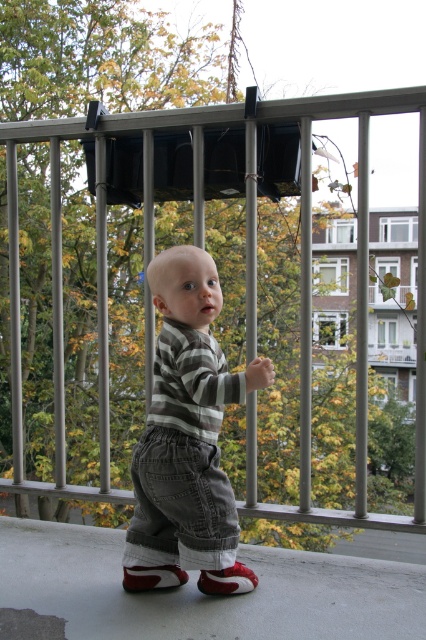
The child is trying to climb over the balcony railing. You are a safety inspector checking if the child can fit through the space between the metallic vertical bars. The child is wearing the red suede sneaker at center and the white leather sneaker at center. Which sneaker is closer to the ground?

The red suede sneaker at center is located below the white leather sneaker at center, so the red suede sneaker at center is closer to the ground.

You are a parent who wants to ensure the child is safe on the balcony. The child is wearing two sneakers, a red suede sneaker at center and a white leather sneaker at center. Considering the spacing between the metallic balcony railings, which sneaker might pose a greater risk of getting stuck between the bars?

The red suede sneaker at center has a larger width than the white leather sneaker at center, so it might pose a greater risk of getting stuck between the metallic balcony railings.

You are a safety inspector evaluating the balcony for a child. You notice two points marked on the balcony surface. The first point is at coordinates point (181, 252) and the second is at point (241, 592). Which point is closer to the child standing on the balcony?

Point (181, 252) is closer to the viewer than point (241, 592), so the first point is closer to the child standing on the balcony.